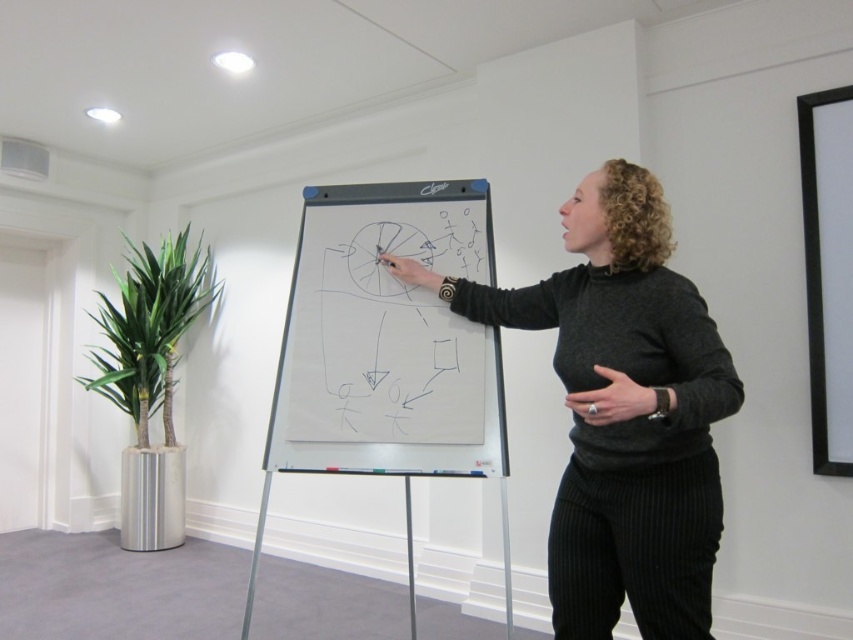
Question: Is dark gray sweater at center positioned in front of whiteboard at center?

Choices:
 (A) no
 (B) yes

Answer: (B)

Question: Can you confirm if dark gray sweater at center is bigger than whiteboard at center?

Choices:
 (A) yes
 (B) no

Answer: (A)

Question: Which point is farther from the camera taking this photo?

Choices:
 (A) (657, 320)
 (B) (302, 464)

Answer: (B)

Question: Which of the following is the closest to the observer?

Choices:
 (A) whiteboard at center
 (B) dark gray sweater at center

Answer: (B)

Question: Which point is farther from the camera taking this photo?

Choices:
 (A) (x=524, y=296)
 (B) (x=354, y=243)

Answer: (B)

Question: In this image, where is dark gray sweater at center located relative to whiteboard at center?

Choices:
 (A) above
 (B) below

Answer: (B)